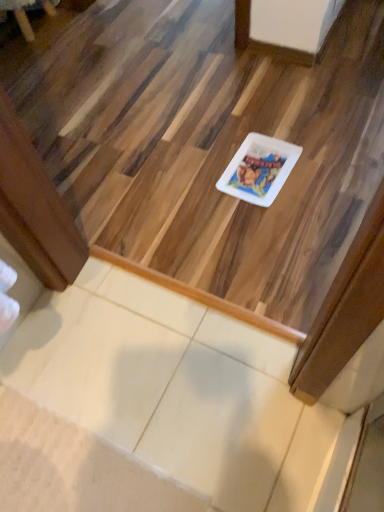
Where is `free location above white glossy plate at center (from a real-world perspective)`? The image size is (384, 512). free location above white glossy plate at center (from a real-world perspective) is located at coordinates (134, 81).